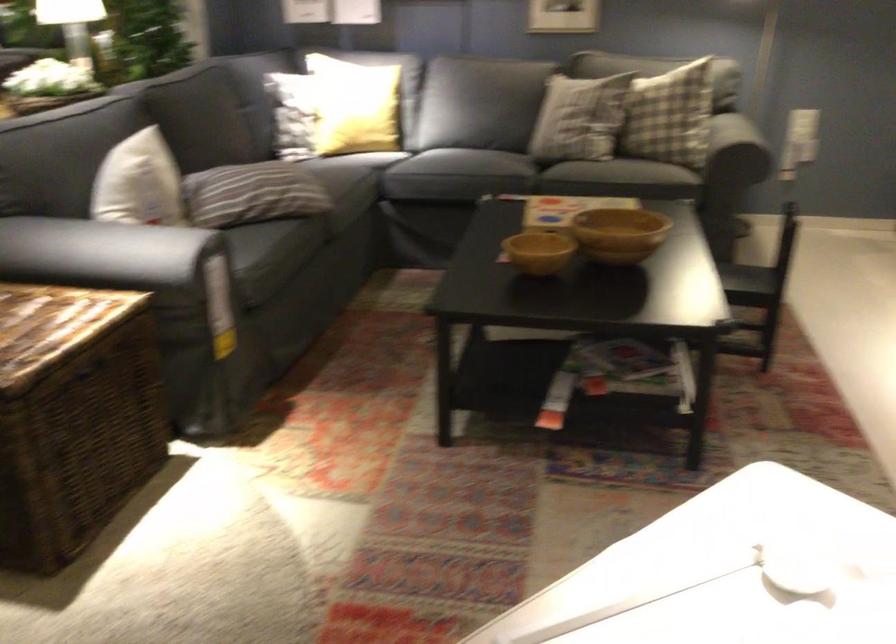
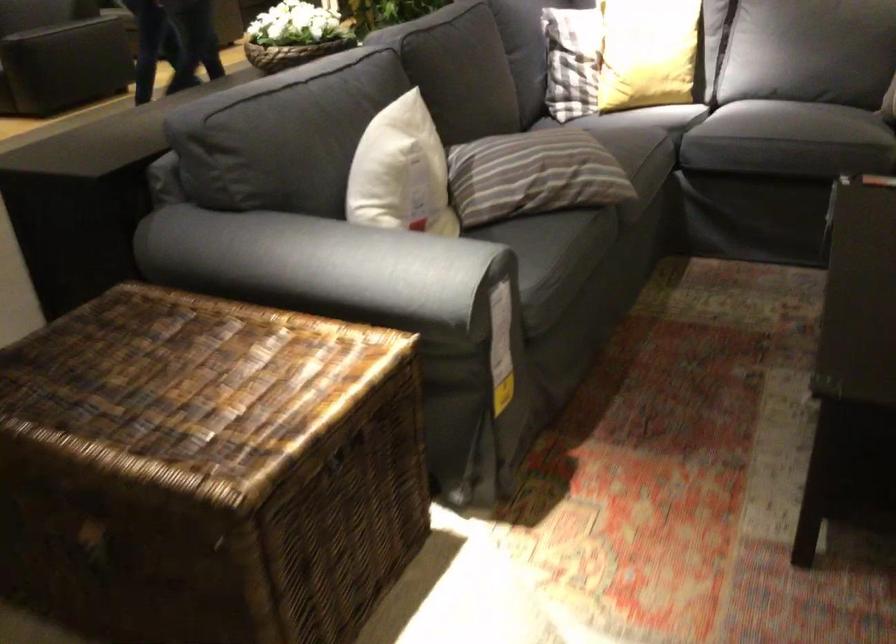
Locate, in the second image, the point that corresponds to [252,192] in the first image.

(533, 174)